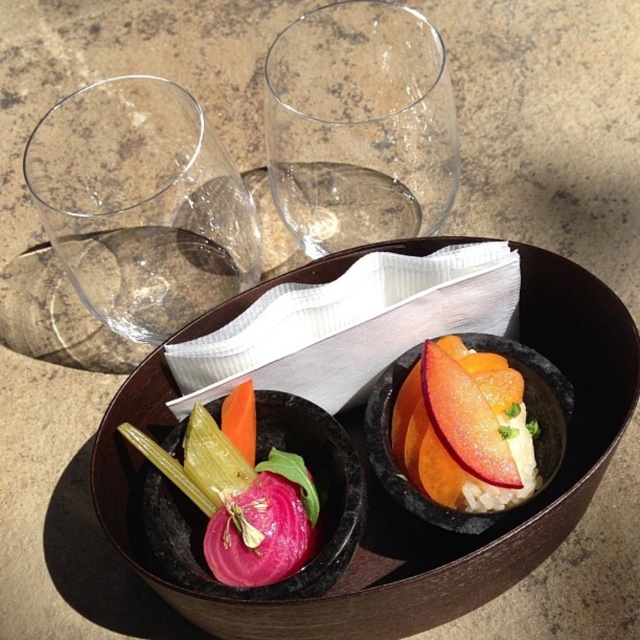
Question: Estimate the real-world distances between objects in this image. Which object is farther from the black stone bowl at center?

Choices:
 (A) transparent glass at upper left
 (B) pink glossy radish at center

Answer: (A)

Question: Is transparent glass at upper left bigger than transparent glass at upper center?

Choices:
 (A) no
 (B) yes

Answer: (B)

Question: Does black stone bowl at center have a greater width compared to transparent glass at upper center?

Choices:
 (A) yes
 (B) no

Answer: (A)

Question: Which object is farther from the camera taking this photo?

Choices:
 (A) sliced apple at center
 (B) black stone bowl at center
 (C) transparent glass at upper left
 (D) pink glossy radish at center

Answer: (C)

Question: Is black stone bowl at center bigger than pink glossy radish at center?

Choices:
 (A) no
 (B) yes

Answer: (B)

Question: Which object appears closest to the camera in this image?

Choices:
 (A) sliced apple at center
 (B) transparent glass at upper left
 (C) transparent glass at upper center
 (D) pink glossy radish at center

Answer: (A)